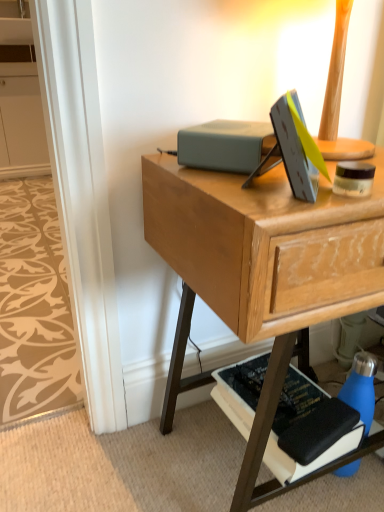
The image size is (384, 512). I want to click on free region on the left part of wooden desk at center, so (x=119, y=462).